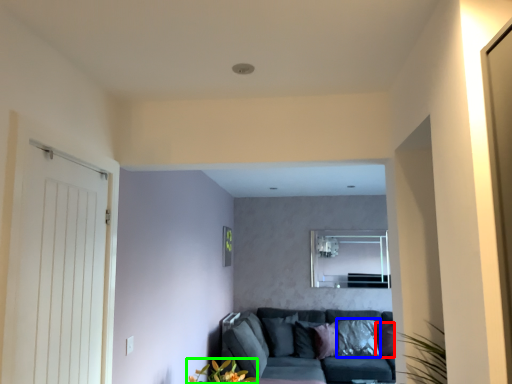
Question: Considering the real-world distances, which object is farthest from pillow (highlighted by a red box)? pillow (highlighted by a blue box) or floral arrangement (highlighted by a green box)?

Choices:
 (A) pillow
 (B) floral arrangement

Answer: (B)